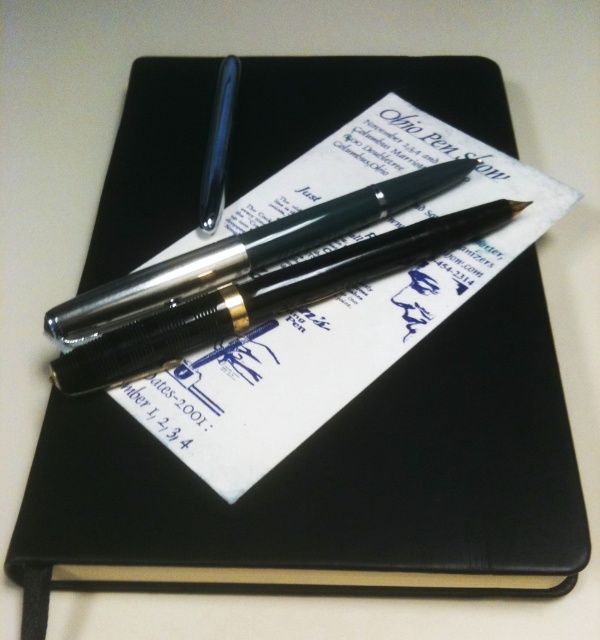
You are organizing a stationery collection and need to place the metallic silver pen at center and glossy black pen at upper center into a vertical pen holder. The holder can only accommodate pens up to the height of the taller pen. Which pen determines the minimum required height for the holder?

The glossy black pen at upper center is taller than the metallic silver pen at center, so the holder must be at least as tall as the glossy black pen at upper center to accommodate both.

You are organizing a stationery collection and need to place the metallic silver pen at center and the glossy black pen at upper center into a pen holder. Which pen should you place first to ensure both fit properly?

The metallic silver pen at center is larger in size than the glossy black pen at upper center, so you should place the larger metallic silver pen at center first to ensure both fit properly.

You are organizing a stationery collection and need to stack the metallic silver pen at center and the glossy black pen at upper center vertically. Which pen should you place at the bottom of the stack to ensure stability?

The metallic silver pen at center should be placed at the bottom of the stack because it is closer to the viewer, meaning it is physically lower and thus more stable at the base.